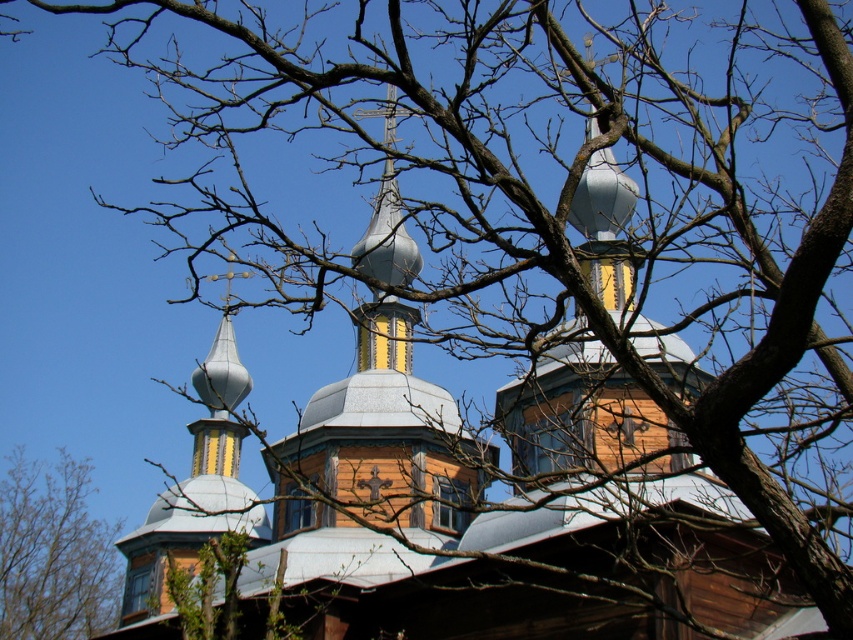
Question: Which object appears closest to the camera in this image?

Choices:
 (A) metallic silver dome at center
 (B) bare branches at lower left

Answer: (A)

Question: Considering the relative positions of metallic silver dome at center and bare branches at lower left in the image provided, where is metallic silver dome at center located with respect to bare branches at lower left?

Choices:
 (A) above
 (B) below

Answer: (A)

Question: Which point appears farthest from the camera in this image?

Choices:
 (A) (26, 595)
 (B) (346, 470)

Answer: (A)

Question: Observing the image, what is the correct spatial positioning of metallic silver dome at center in reference to bare branches at lower left?

Choices:
 (A) right
 (B) left

Answer: (A)

Question: Does metallic silver dome at center appear over bare branches at lower left?

Choices:
 (A) no
 (B) yes

Answer: (B)

Question: Which object appears closest to the camera in this image?

Choices:
 (A) metallic silver dome at center
 (B) bare branches at lower left

Answer: (A)